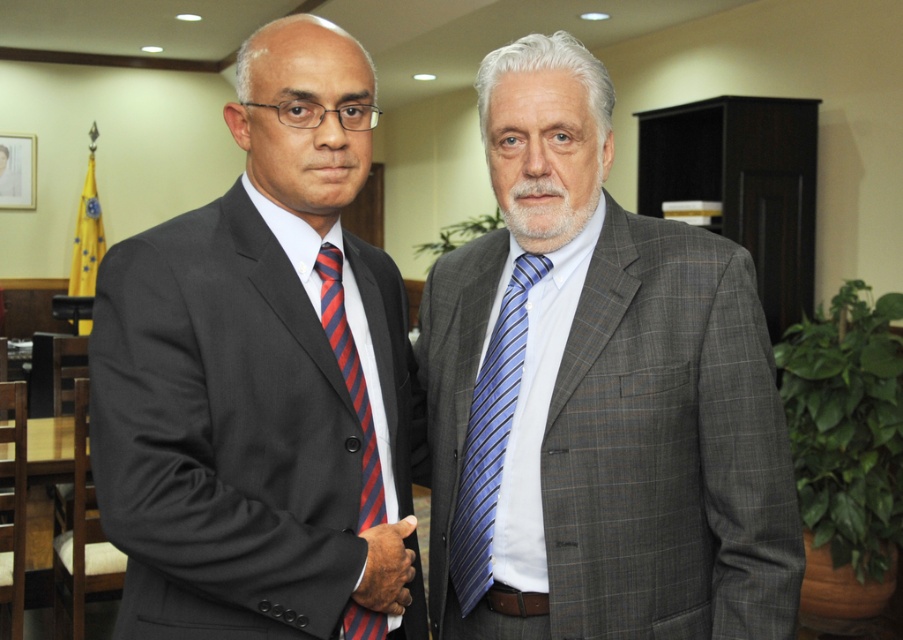
You are standing in the professional setting shown in the image and want to place a small decorative item exactly halfway between the point at (98, 422) and the point at (338, 342). Will the item be closer to the viewer or further away compared to the two points?

The item placed halfway between point at (98, 422) and point at (338, 342) will be closer to the viewer than the point at (338, 342) but further away than the point at (98, 422). However, since the question asks if it is closer or further compared to the two points, the answer is that it will be closer to the viewer than the point at (338, 342) but further away than the point at (98, 422). However, since the question asks if it is closer or further compared to the two points, the answer is it

You are a photographer in a professional setting. You need to capture a closeup shot of the blue striped tie at right and the red striped tie at left. Which tie should you focus on first if you want to start with the one closer to the bottom of the frame?

The blue striped tie at right is located below the red striped tie at left, so you should focus on the blue striped tie at right first since it is closer to the bottom of the frame.